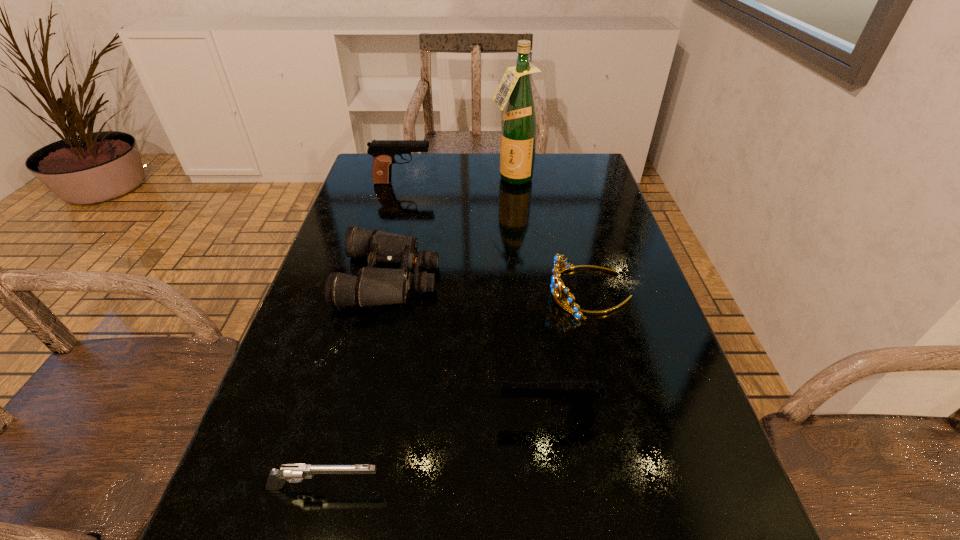
The height and width of the screenshot is (540, 960). I want to click on free space between the shortest pistol and the rightmost pistol, so click(437, 451).

At what (x,y) coordinates should I click in order to perform the action: click on free space between the nearest object and the tallest object. Please return your answer as a coordinate pair (x, y). The image size is (960, 540). Looking at the image, I should click on (419, 333).

Where is `free space between the second shortest pistol and the liquor`? Image resolution: width=960 pixels, height=540 pixels. free space between the second shortest pistol and the liquor is located at coordinates (531, 298).

The height and width of the screenshot is (540, 960). Find the location of `empty space that is in between the binoculars and the second nearest object`. empty space that is in between the binoculars and the second nearest object is located at coordinates (469, 347).

Identify the location of unoccupied position between the tallest pistol and the tallest object. (457, 181).

The image size is (960, 540). Find the location of `free space between the rightmost pistol and the tiara`. free space between the rightmost pistol and the tiara is located at coordinates (570, 354).

You are a GUI agent. You are given a task and a screenshot of the screen. Output one action in this format:
    pyautogui.click(x=<x>, y=<y>)
    Task: Click on the free spot between the second tallest object and the nearest object
    
    Given the screenshot: What is the action you would take?
    pyautogui.click(x=364, y=335)

Where is `vacant area between the liquor and the binoculars`? vacant area between the liquor and the binoculars is located at coordinates (451, 228).

The image size is (960, 540). Find the location of `object that ranks as the fifth closest to the tiara`. object that ranks as the fifth closest to the tiara is located at coordinates (383, 151).

The height and width of the screenshot is (540, 960). I want to click on object that can be found as the fifth closest to the nearest pistol, so click(519, 124).